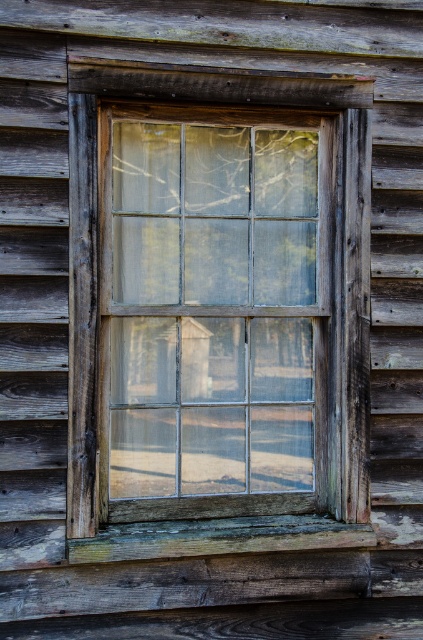
Who is lower down, clear glass window at center or weathered wood at lower center?

weathered wood at lower center is lower down.

Does clear glass window at center have a lesser height compared to weathered wood at lower center?

In fact, clear glass window at center may be taller than weathered wood at lower center.

Describe the element at coordinates (213, 310) in the screenshot. I see `clear glass window at center` at that location.

This screenshot has height=640, width=423. I want to click on clear glass window at center, so click(213, 310).